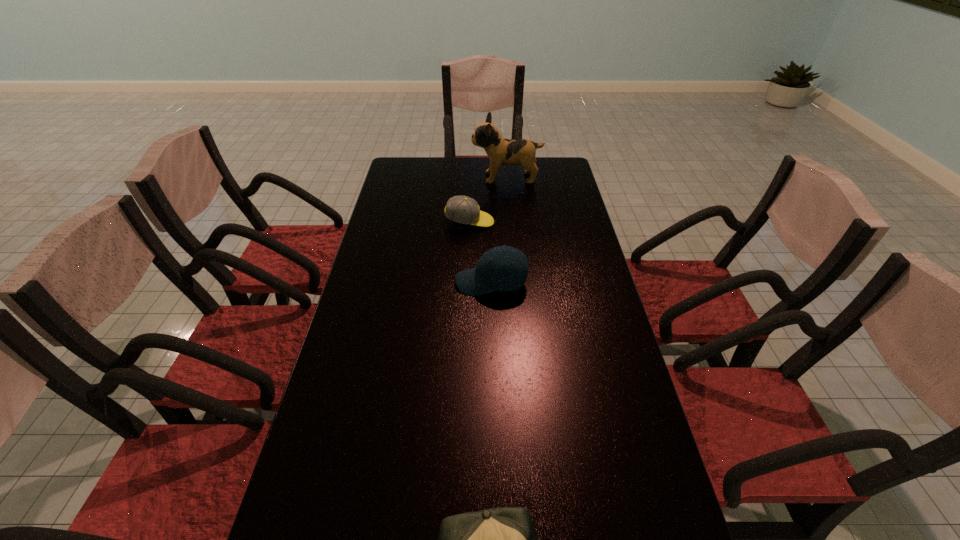
Find the location of a particular element. free space located on the front-facing side of the second farthest baseball cap is located at coordinates (391, 282).

At what (x,y) coordinates should I click in order to perform the action: click on vacant space located on the front-facing side of the farthest baseball cap. Please return your answer as a coordinate pair (x, y). Looking at the image, I should click on (571, 222).

This screenshot has width=960, height=540. Identify the location of object located at the far edge. (499, 150).

You are a GUI agent. You are given a task and a screenshot of the screen. Output one action in this format:
    pyautogui.click(x=<x>, y=<y>)
    Task: Click on the object located in the right edge section of the desktop
    The height and width of the screenshot is (540, 960).
    Given the screenshot: What is the action you would take?
    coord(499,150)

The height and width of the screenshot is (540, 960). Find the location of `object that is at the far right corner`. object that is at the far right corner is located at coordinates (499, 150).

This screenshot has width=960, height=540. In the image, there is a desktop. In order to click on free space at the far edge in this screenshot , I will do `click(460, 167)`.

Where is `free point at the left edge`? free point at the left edge is located at coordinates (387, 204).

The height and width of the screenshot is (540, 960). I want to click on blank area at the right edge, so click(551, 274).

The image size is (960, 540). I want to click on vacant space at the far left corner of the desktop, so click(x=402, y=162).

Locate an element on the screen. The height and width of the screenshot is (540, 960). vacant space that is in between the tallest baseball cap and the farthest baseball cap is located at coordinates (481, 252).